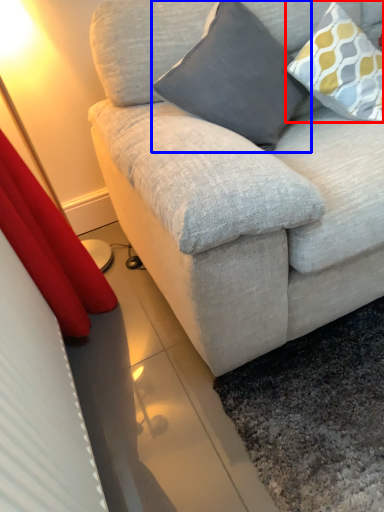
Question: Which point is closer to the camera, pillow (highlighted by a red box) or pillow (highlighted by a blue box)?

Choices:
 (A) pillow
 (B) pillow

Answer: (B)